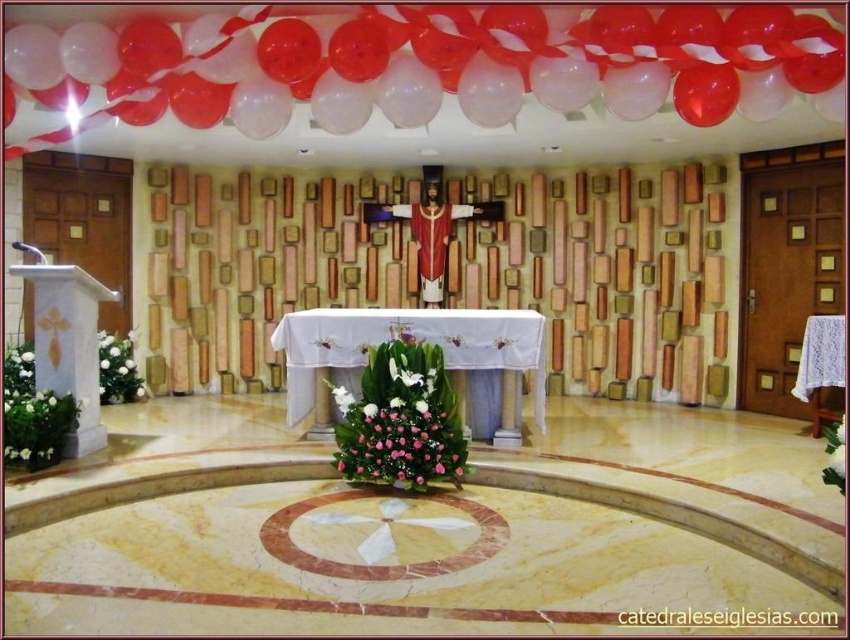
Is transparent plastic balloon at upper center positioned behind pink floral arrangement at center?

No, transparent plastic balloon at upper center is closer to the viewer.

Is transparent plastic balloon at upper center below pink floral arrangement at center?

Actually, transparent plastic balloon at upper center is above pink floral arrangement at center.

Who is more forward, (x=812, y=35) or (x=404, y=400)?

Point (x=812, y=35)

The width and height of the screenshot is (850, 640). Identify the location of transparent plastic balloon at upper center. (426, 65).

Can you confirm if white embroidered cloth at center is shorter than white floral arrangement at left?

No, white embroidered cloth at center is not shorter than white floral arrangement at left.

Who is taller, white embroidered cloth at center or white floral arrangement at left?

white embroidered cloth at center

Measure the distance between point (510, 364) and camera.

Point (510, 364) and camera are 4.94 meters apart from each other.

You are a GUI agent. You are given a task and a screenshot of the screen. Output one action in this format:
    pyautogui.click(x=<x>, y=<y>)
    Task: Click on the white embroidered cloth at center
    
    Given the screenshot: What is the action you would take?
    pyautogui.click(x=412, y=333)

Who is shorter, shiny red fabric crucifix at center or white floral arrangement at left?

Standing shorter between the two is white floral arrangement at left.

Can you confirm if shiny red fabric crucifix at center is wider than white floral arrangement at left?

Yes.

Which is in front, point (432, 259) or point (112, 403)?

Point (112, 403) is in front.

The height and width of the screenshot is (640, 850). Identify the location of shiny red fabric crucifix at center. (431, 237).